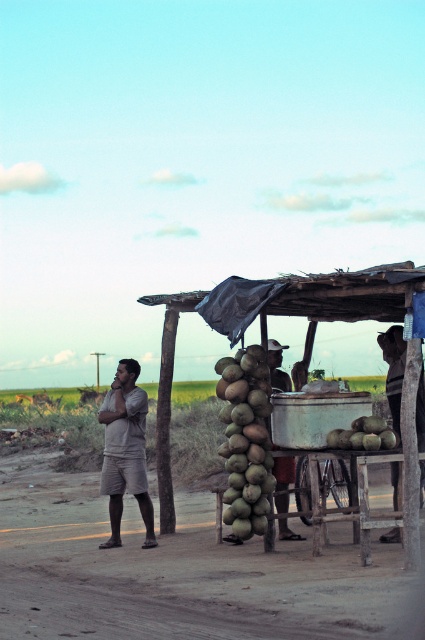
Based on the photo, can you confirm if green rough coconut at center is thinner than brown leather hat at center?

No, green rough coconut at center is not thinner than brown leather hat at center.

Is point (249, 365) farther from viewer compared to point (280, 493)?

No, it is not.

Locate an element on the screen. This screenshot has width=425, height=640. green rough coconut at center is located at coordinates [246, 442].

What do you see at coordinates (277, 365) in the screenshot? I see `brown leather hat at center` at bounding box center [277, 365].

Is point (289, 385) less distant than point (340, 429)?

No.

I want to click on brown leather hat at center, so click(277, 365).

You are a GUI agent. You are given a task and a screenshot of the screen. Output one action in this format:
    pyautogui.click(x=<x>, y=<y>)
    Task: Click on the brown leather hat at center
    Image resolution: width=425 pixels, height=640 pixels.
    Given the screenshot: What is the action you would take?
    pyautogui.click(x=277, y=365)

Does point (235, 513) come behind point (387, 358)?

No, (235, 513) is in front of (387, 358).

Image resolution: width=425 pixels, height=640 pixels. Describe the element at coordinates (246, 442) in the screenshot. I see `green rough coconut at center` at that location.

The height and width of the screenshot is (640, 425). What are the coordinates of `green rough coconut at center` in the screenshot? It's located at (246, 442).